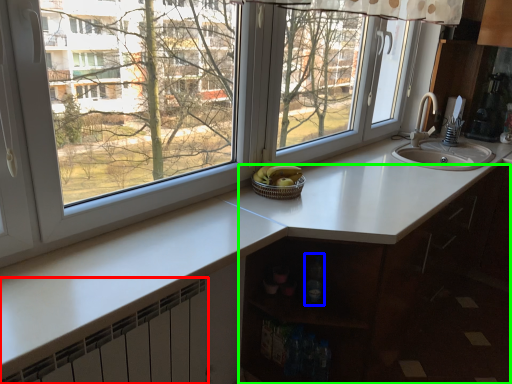
Question: Considering the real-world distances, which object is closest to radiator (highlighted by a red box)? bottle (highlighted by a blue box) or cabinetry (highlighted by a green box).

Choices:
 (A) bottle
 (B) cabinetry

Answer: (A)